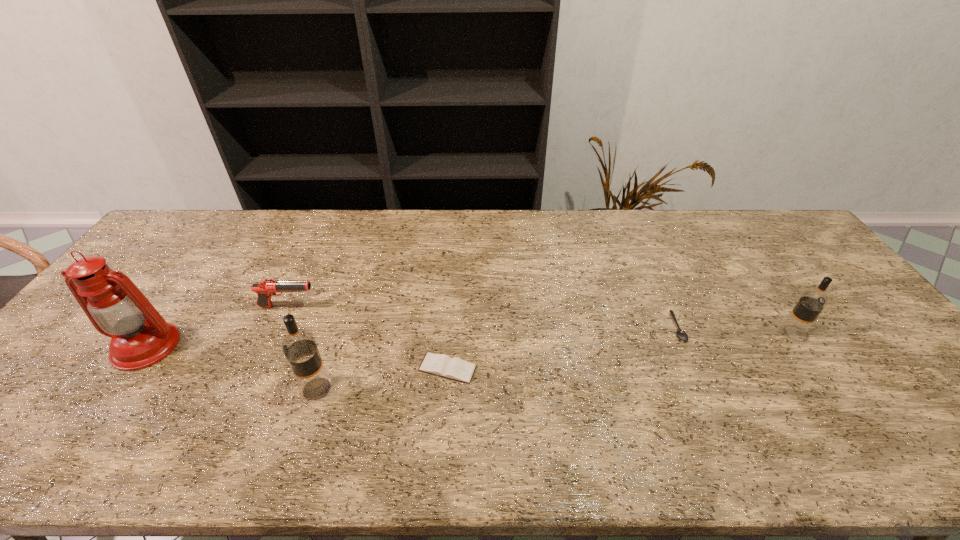
Where is `object positioned at the near edge`? The height and width of the screenshot is (540, 960). object positioned at the near edge is located at coordinates (300, 348).

This screenshot has width=960, height=540. I want to click on object positioned at the left edge, so click(140, 337).

This screenshot has width=960, height=540. In the image, there is a desktop. Identify the location of free space at the far edge. (474, 217).

The width and height of the screenshot is (960, 540). What are the coordinates of `vacant region at the left edge of the desktop` in the screenshot? It's located at (138, 264).

The image size is (960, 540). Identify the location of blank area at the right edge. (851, 354).

This screenshot has height=540, width=960. I want to click on unoccupied area between the third object from right to left and the rightmost object, so tap(619, 351).

Find the location of `empty space between the leftmost object and the rightmost object`. empty space between the leftmost object and the rightmost object is located at coordinates (468, 340).

Where is `free space that is in between the fifth tallest object and the second object from right to left`? Image resolution: width=960 pixels, height=540 pixels. free space that is in between the fifth tallest object and the second object from right to left is located at coordinates (563, 348).

Locate an element on the screen. This screenshot has width=960, height=540. empty location between the taller vodka and the farther vodka is located at coordinates (554, 361).

Locate an element on the screen. The width and height of the screenshot is (960, 540). free area in between the shortest object and the second shortest object is located at coordinates (563, 348).